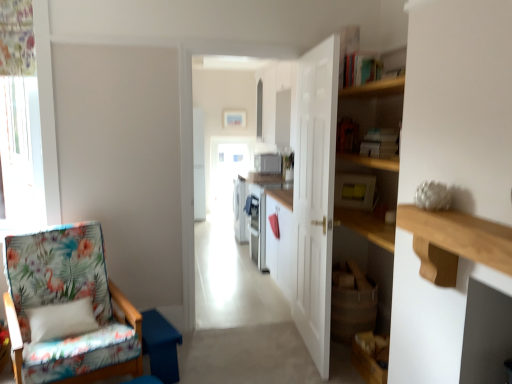
Question: Is white glossy microwave at center further to the viewer compared to white wooden door at center?

Choices:
 (A) no
 (B) yes

Answer: (B)

Question: Considering the relative positions of white glossy microwave at center and white wooden door at center in the image provided, is white glossy microwave at center to the right of white wooden door at center from the viewer's perspective?

Choices:
 (A) no
 (B) yes

Answer: (A)

Question: Is white glossy microwave at center oriented towards white wooden door at center?

Choices:
 (A) yes
 (B) no

Answer: (A)

Question: Is white glossy microwave at center in front of white wooden door at center?

Choices:
 (A) yes
 (B) no

Answer: (B)

Question: Is white glossy microwave at center turned away from white wooden door at center?

Choices:
 (A) yes
 (B) no

Answer: (B)

Question: Considering the positions of point (278, 168) and point (365, 200), is point (278, 168) closer or farther from the camera than point (365, 200)?

Choices:
 (A) farther
 (B) closer

Answer: (A)

Question: From the image's perspective, relative to yellow plastic microwave at upper center, the second appliance from the left, is white glossy microwave at center, which is the 2th appliance from right to left, above or below?

Choices:
 (A) below
 (B) above

Answer: (B)

Question: Is white glossy microwave at center, which is the 2th appliance from right to left, in front of or behind yellow plastic microwave at upper center, which is counted as the first appliance, starting from the bottom, in the image?

Choices:
 (A) behind
 (B) front

Answer: (A)

Question: From a real-world perspective, relative to yellow plastic microwave at upper center, which is counted as the first appliance, starting from the bottom, is white glossy microwave at center, arranged as the 1th appliance when viewed from the back, vertically above or below?

Choices:
 (A) above
 (B) below

Answer: (B)

Question: Looking at the image, does floral fabric chair at left seem bigger or smaller compared to white glossy microwave at center?

Choices:
 (A) small
 (B) big

Answer: (B)

Question: In the image, is floral fabric chair at left positioned in front of or behind white glossy microwave at center?

Choices:
 (A) front
 (B) behind

Answer: (A)

Question: From the image's perspective, relative to white glossy microwave at center, is floral fabric chair at left above or below?

Choices:
 (A) above
 (B) below

Answer: (B)

Question: Considering the positions of floral fabric chair at left and white glossy microwave at center in the image, is floral fabric chair at left taller or shorter than white glossy microwave at center?

Choices:
 (A) short
 (B) tall

Answer: (A)

Question: From a real-world perspective, is white wooden door at center above or below white glossy microwave at center?

Choices:
 (A) above
 (B) below

Answer: (B)

Question: In terms of height, does white wooden door at center look taller or shorter compared to white glossy microwave at center?

Choices:
 (A) short
 (B) tall

Answer: (A)